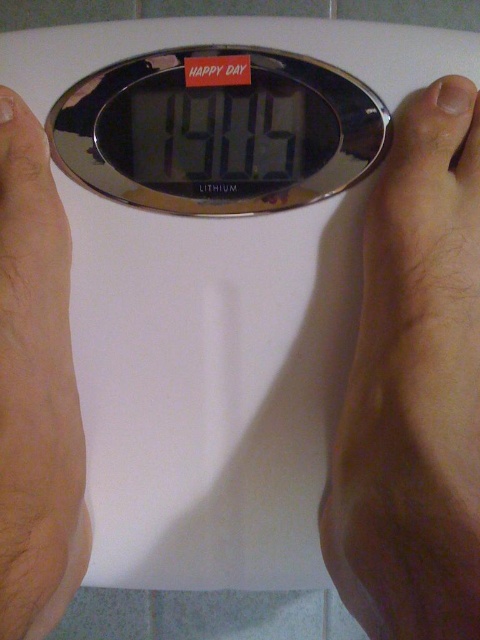
Question: Is the position of dry skin at right more distant than that of skinny flesh at left?

Choices:
 (A) no
 (B) yes

Answer: (A)

Question: Does dry skin at right have a lesser width compared to skinny flesh at left?

Choices:
 (A) no
 (B) yes

Answer: (A)

Question: Does dry skin at right appear on the right side of skinny flesh at left?

Choices:
 (A) no
 (B) yes

Answer: (B)